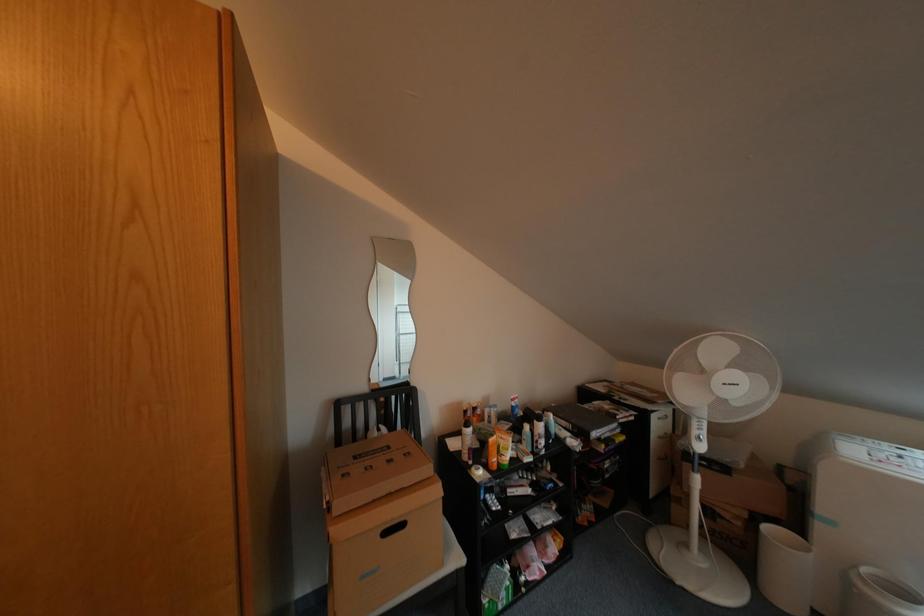
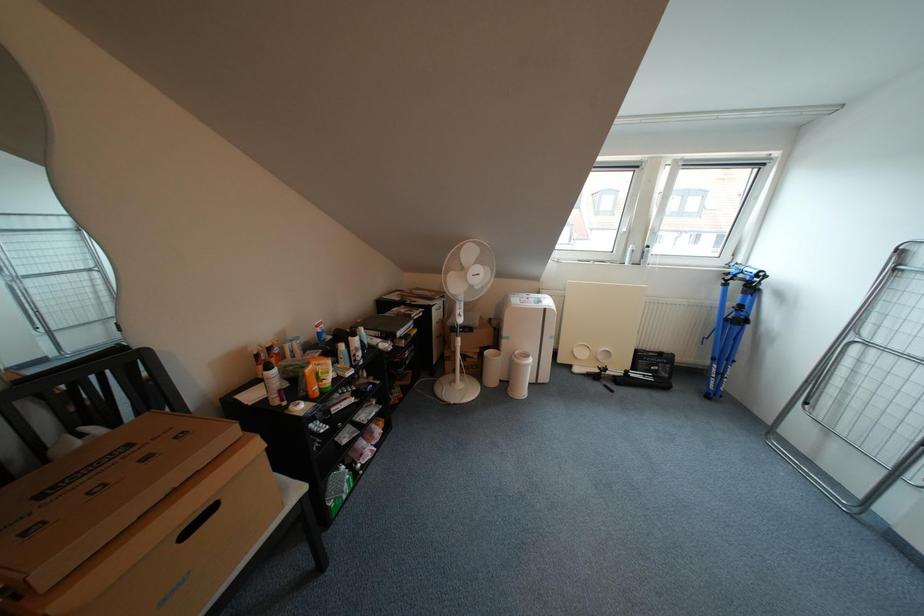
Based on the continuous images, in which direction is the camera rotating?

The camera's rotation is toward right-down.